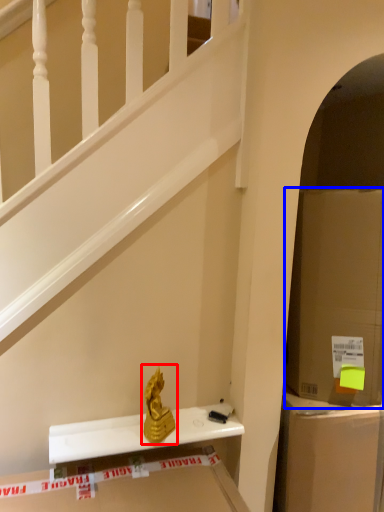
Question: Which of the following is the closest to the observer, sculpture (highlighted by a red box) or cardboard box (highlighted by a blue box)?

Choices:
 (A) sculpture
 (B) cardboard box

Answer: (B)